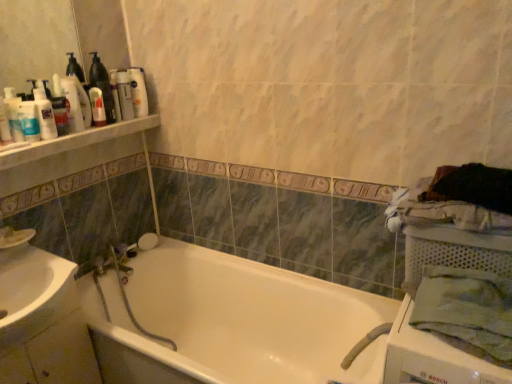
Question: Is the position of white glossy bathtub at center less distant than that of green cotton bath towel at right?

Choices:
 (A) no
 (B) yes

Answer: (A)

Question: From the image's perspective, would you say white glossy bathtub at center is shown under green cotton bath towel at right?

Choices:
 (A) no
 (B) yes

Answer: (B)

Question: Is white glossy bathtub at center positioned far away from green cotton bath towel at right?

Choices:
 (A) yes
 (B) no

Answer: (B)

Question: Is green cotton bath towel at right located within white glossy bathtub at center?

Choices:
 (A) yes
 (B) no

Answer: (B)

Question: Could you tell me if white glossy bathtub at center is facing green cotton bath towel at right?

Choices:
 (A) yes
 (B) no

Answer: (B)

Question: In terms of width, does matte white lotion at upper left, arranged as the fourth toiletry when viewed from the back, look wider or thinner when compared to white plastic shelf at upper left?

Choices:
 (A) thin
 (B) wide

Answer: (A)

Question: From a real-world perspective, relative to white plastic shelf at upper left, is matte white lotion at upper left, arranged as the fourth toiletry when viewed from the back, vertically above or below?

Choices:
 (A) below
 (B) above

Answer: (B)

Question: Based on their sizes in the image, would you say matte white lotion at upper left, which is the second toiletry in front-to-back order, is bigger or smaller than white plastic shelf at upper left?

Choices:
 (A) small
 (B) big

Answer: (A)

Question: From the image's perspective, is matte white lotion at upper left, arranged as the fourth toiletry when viewed from the back, positioned above or below white plastic shelf at upper left?

Choices:
 (A) below
 (B) above

Answer: (B)

Question: Is point (13, 344) positioned closer to the camera than point (52, 97)?

Choices:
 (A) farther
 (B) closer

Answer: (B)

Question: In terms of height, does white glossy sink at lower left look taller or shorter compared to matte plastic bottle at upper left, which is the 3th toiletry from back to front?

Choices:
 (A) short
 (B) tall

Answer: (B)

Question: Is white glossy sink at lower left inside or outside of matte plastic bottle at upper left, positioned as the 3th toiletry in front-to-back order?

Choices:
 (A) outside
 (B) inside

Answer: (A)

Question: From a real-world perspective, relative to matte plastic bottle at upper left, which is the 3th toiletry from back to front, is white glossy sink at lower left vertically above or below?

Choices:
 (A) below
 (B) above

Answer: (A)

Question: Relative to matte white lotion at upper left, which is counted as the fifth toiletry, starting from the front, is green cotton bath towel at right in front or behind?

Choices:
 (A) front
 (B) behind

Answer: (A)

Question: In terms of width, does green cotton bath towel at right look wider or thinner when compared to matte white lotion at upper left, which is counted as the fifth toiletry, starting from the front?

Choices:
 (A) wide
 (B) thin

Answer: (A)